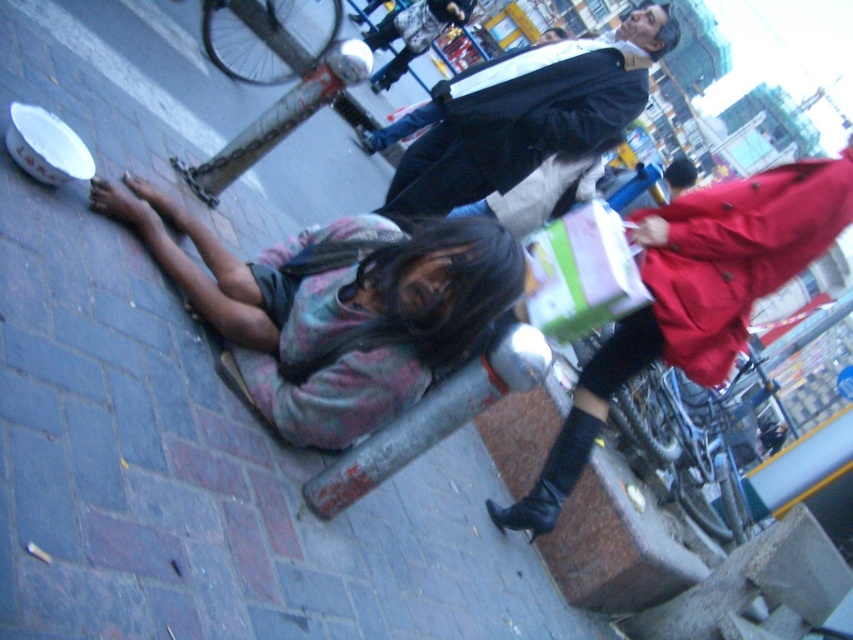
You are a photographer standing on the street and want to take a picture of the dark blue leather jacket at upper center without including the brick pavement at lower left in the frame. Is this possible based on their positions?

The brick pavement at lower left is to the left of the dark blue leather jacket at upper center, so if you position yourself to the right side of the jacket, you can frame the shot to exclude the pavement.

You are a photographer trying to capture the scene from above. You notice the brick pavement at lower left and the multicolored fabric at lower left. Which object is closer to the camera?

The brick pavement at lower left is positioned over the multicolored fabric at lower left, so it is closer to the camera.

You are a delivery drone with a 1 meter wingspan. You need to fly over the brick pavement at lower left and the dark blue leather jacket at upper center. Which path is wider for your flight?

The brick pavement at lower left might be wider than dark blue leather jacket at upper center, so the brick pavement at lower left is the wider path for the drone to fly over.